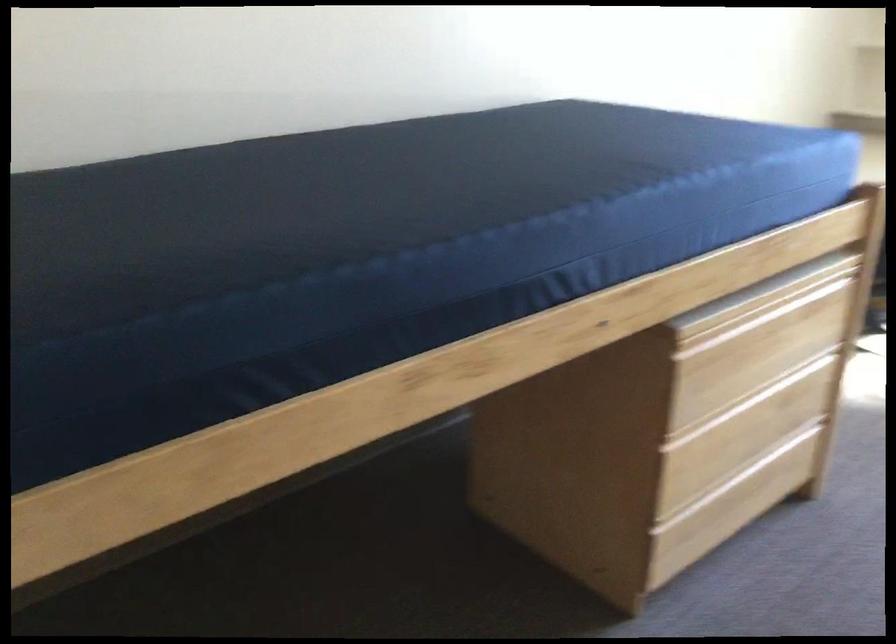
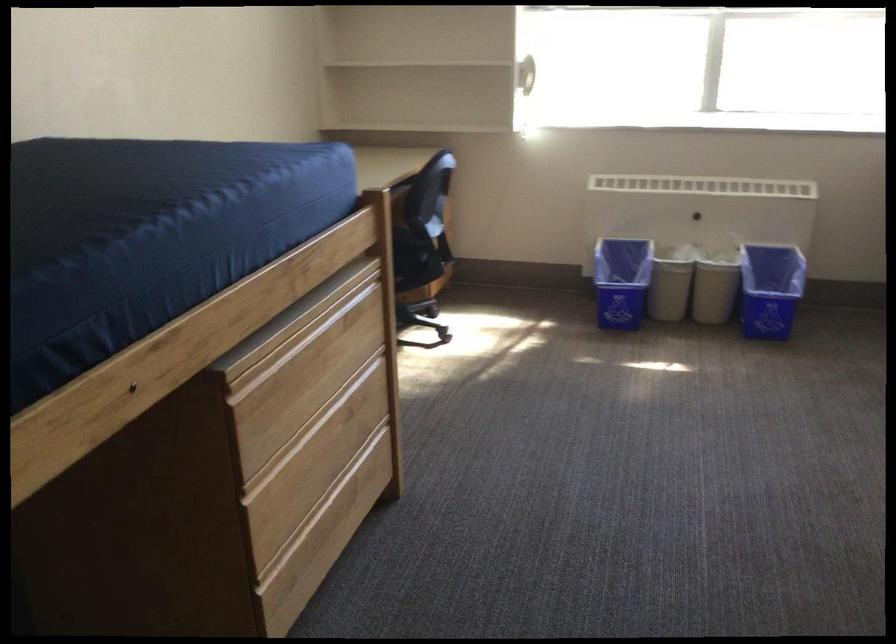
The point at (746, 324) is marked in the first image. Where is the corresponding point in the second image?

(296, 346)